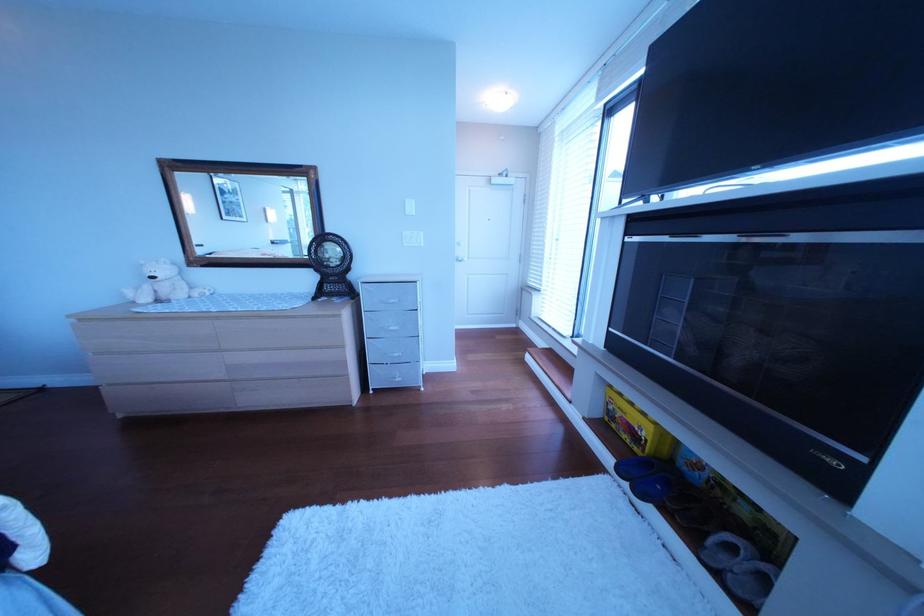
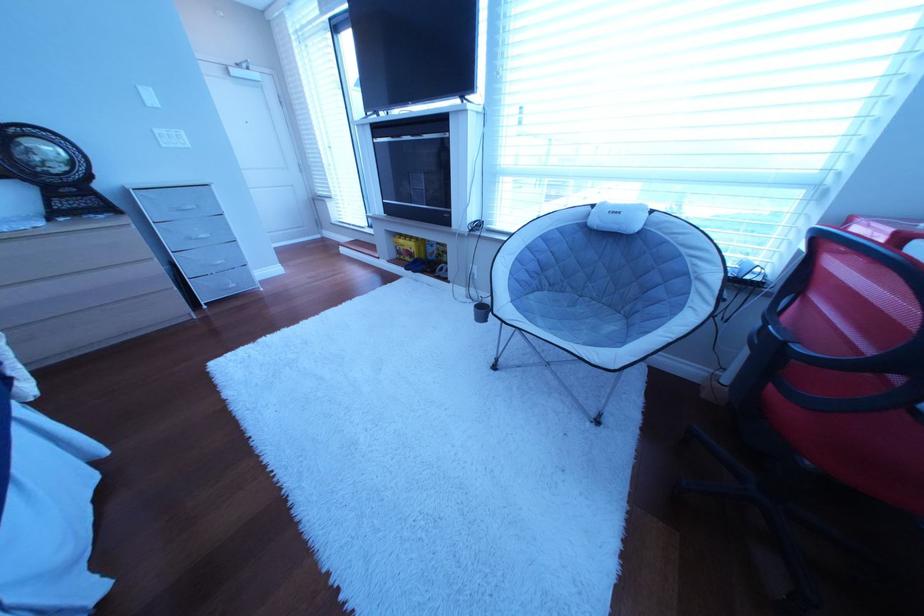
Find the pixel in the second image that matches point (635, 416) in the first image.

(418, 251)